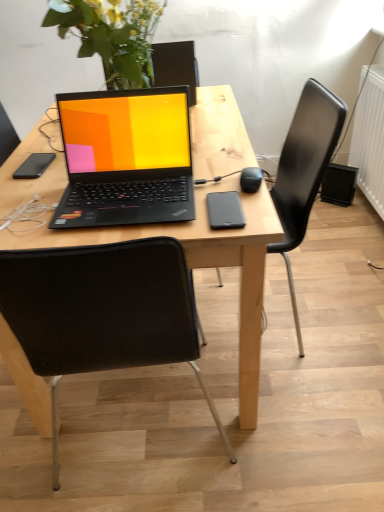
Question: Is wooden desk at center facing towards black fabric chair at center, placed as the second chair when sorted from right to left?

Choices:
 (A) yes
 (B) no

Answer: (B)

Question: Is wooden desk at center far from black fabric chair at center, placed as the second chair when sorted from right to left?

Choices:
 (A) yes
 (B) no

Answer: (B)

Question: Is wooden desk at center facing away from black fabric chair at center, placed as the second chair when sorted from right to left?

Choices:
 (A) no
 (B) yes

Answer: (A)

Question: Does wooden desk at center have a lesser height compared to black fabric chair at center, placed as the second chair when sorted from right to left?

Choices:
 (A) no
 (B) yes

Answer: (B)

Question: Is wooden desk at center beside black fabric chair at center, marked as the 1th chair in a left-to-right arrangement?

Choices:
 (A) no
 (B) yes

Answer: (A)

Question: Does point (312, 93) appear closer or farther from the camera than point (241, 183)?

Choices:
 (A) farther
 (B) closer

Answer: (A)

Question: From a real-world perspective, is black plastic chair at center, positioned as the first chair in right-to-left order, physically located above or below black matte computer mouse at center-right?

Choices:
 (A) above
 (B) below

Answer: (B)

Question: Considering the relative positions of black plastic chair at center, positioned as the first chair in right-to-left order, and black matte computer mouse at center-right in the image provided, is black plastic chair at center, positioned as the first chair in right-to-left order, to the left or to the right of black matte computer mouse at center-right?

Choices:
 (A) left
 (B) right

Answer: (B)

Question: From the image's perspective, is black plastic chair at center, positioned as the first chair in right-to-left order, positioned above or below black matte computer mouse at center-right?

Choices:
 (A) below
 (B) above

Answer: (A)

Question: Considering the positions of black matte phone at left, which ranks as the 1th mobile phone in left-to-right order, and black matte computer mouse at center-right in the image, is black matte phone at left, which ranks as the 1th mobile phone in left-to-right order, wider or thinner than black matte computer mouse at center-right?

Choices:
 (A) wide
 (B) thin

Answer: (A)

Question: In terms of size, does black matte phone at left, which appears as the second mobile phone when ordered from the bottom, appear bigger or smaller than black matte computer mouse at center-right?

Choices:
 (A) big
 (B) small

Answer: (B)

Question: Is black matte phone at left, which appears as the second mobile phone when ordered from the bottom, in front of or behind black matte computer mouse at center-right in the image?

Choices:
 (A) behind
 (B) front

Answer: (A)

Question: Considering the positions of black matte phone at left, acting as the second mobile phone starting from the front, and black matte computer mouse at center-right in the image, is black matte phone at left, acting as the second mobile phone starting from the front, taller or shorter than black matte computer mouse at center-right?

Choices:
 (A) tall
 (B) short

Answer: (B)

Question: In terms of height, does black matte phone at left, which appears as the second mobile phone when ordered from the bottom, look taller or shorter compared to black plastic chair at center, positioned as the first chair in right-to-left order?

Choices:
 (A) tall
 (B) short

Answer: (B)

Question: Considering the positions of black matte phone at left, acting as the second mobile phone starting from the front, and black plastic chair at center, positioned as the first chair in right-to-left order, in the image, is black matte phone at left, acting as the second mobile phone starting from the front, wider or thinner than black plastic chair at center, positioned as the first chair in right-to-left order,?

Choices:
 (A) wide
 (B) thin

Answer: (B)